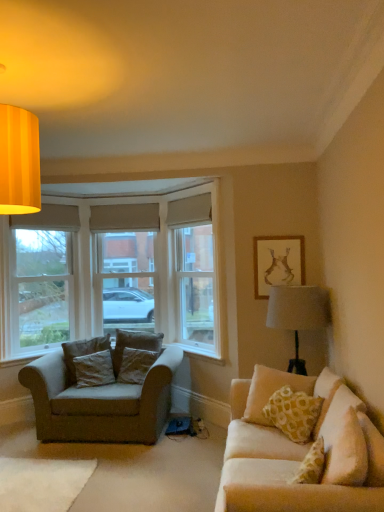
Question: Is velvet beige pillow at right, the 4th pillow when ordered from back to front, not within beige fabric window screen at center?

Choices:
 (A) no
 (B) yes

Answer: (B)

Question: Considering the relative sizes of velvet beige pillow at right, which appears as the 1th pillow when viewed from the right, and beige fabric window screen at center in the image provided, is velvet beige pillow at right, which appears as the 1th pillow when viewed from the right, taller than beige fabric window screen at center?

Choices:
 (A) no
 (B) yes

Answer: (A)

Question: Could you tell me if velvet beige pillow at right, which appears as the 1th pillow when viewed from the right, is turned towards beige fabric window screen at center?

Choices:
 (A) yes
 (B) no

Answer: (B)

Question: Is velvet beige pillow at right, the 4th pillow when ordered from back to front, turned away from beige fabric window screen at center?

Choices:
 (A) no
 (B) yes

Answer: (A)

Question: Can you confirm if velvet beige pillow at right, the fourth pillow in the left-to-right sequence, is thinner than beige fabric window screen at center?

Choices:
 (A) no
 (B) yes

Answer: (B)

Question: Looking at their shapes, would you say dark brown fabric pillow at left, which appears as the fourth pillow when viewed from the right, is wider or thinner than velvet beige pillow at right, the 4th pillow when ordered from back to front?

Choices:
 (A) thin
 (B) wide

Answer: (B)

Question: From the image's perspective, is dark brown fabric pillow at left, the first pillow when ordered from left to right, located above or below velvet beige pillow at right, the fourth pillow in the left-to-right sequence?

Choices:
 (A) below
 (B) above

Answer: (A)

Question: Based on their sizes in the image, would you say dark brown fabric pillow at left, which appears as the fourth pillow when viewed from the right, is bigger or smaller than velvet beige pillow at right, the 4th pillow when ordered from back to front?

Choices:
 (A) big
 (B) small

Answer: (B)

Question: From a real-world perspective, is dark brown fabric pillow at left, the first pillow when ordered from left to right, positioned above or below velvet beige pillow at right, the 1th pillow viewed from the front?

Choices:
 (A) above
 (B) below

Answer: (B)

Question: Does point (127, 365) appear closer or farther from the camera than point (256, 267)?

Choices:
 (A) farther
 (B) closer

Answer: (A)

Question: Do you think dark gray fabric pillow at left, placed as the 2th pillow when sorted from right to left, is within matte gold picture frame at upper right, or outside of it?

Choices:
 (A) inside
 (B) outside

Answer: (B)

Question: Is dark gray fabric pillow at left, which is the 2th pillow in back-to-front order, taller or shorter than matte gold picture frame at upper right?

Choices:
 (A) tall
 (B) short

Answer: (B)

Question: From the image's perspective, is dark gray fabric pillow at left, which is the 2th pillow in back-to-front order, above or below matte gold picture frame at upper right?

Choices:
 (A) below
 (B) above

Answer: (A)

Question: Is white painted wood window frame at left situated inside matte gold picture frame at upper right or outside?

Choices:
 (A) outside
 (B) inside

Answer: (A)

Question: From their relative heights in the image, would you say white painted wood window frame at left is taller or shorter than matte gold picture frame at upper right?

Choices:
 (A) short
 (B) tall

Answer: (B)